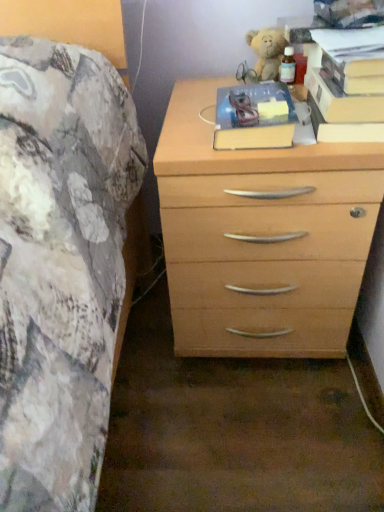
Describe the element at coordinates (356, 71) in the screenshot. I see `hardcover book at upper right, marked as the first paperback book in a right-to-left arrangement` at that location.

This screenshot has width=384, height=512. In order to click on hardcover book at upper right, placed as the 2th paperback book when sorted from left to right in this screenshot , I will do `click(342, 101)`.

At what (x,y) coordinates should I click in order to perform the action: click on hardcover book at upper right, marked as the first paperback book in a right-to-left arrangement. Please return your answer as a coordinate pair (x, y). Looking at the image, I should click on (356, 71).

Does hardcover book at upper right, marked as the first paperback book in a right-to-left arrangement, turn towards hardcover book at center, the 3th paperback book viewed from the right?

No, hardcover book at upper right, marked as the first paperback book in a right-to-left arrangement, does not turn towards hardcover book at center, the 3th paperback book viewed from the right.

Is point (374, 83) closer or farther from the camera than point (241, 115)?

Point (374, 83) is positioned closer to the camera compared to point (241, 115).

Between hardcover book at upper right, placed as the third paperback book when sorted from left to right, and hardcover book at center, which appears as the 1th paperback book when viewed from the left, which one has larger size?

Bigger between the two is hardcover book at center, which appears as the 1th paperback book when viewed from the left.

From a real-world perspective, is light wood chest of drawers at right beneath hardcover book at upper right, placed as the third paperback book when sorted from left to right?

Yes, from a real-world perspective, light wood chest of drawers at right is below hardcover book at upper right, placed as the third paperback book when sorted from left to right.

Who is shorter, light wood chest of drawers at right or hardcover book at upper right, marked as the first paperback book in a right-to-left arrangement?

Standing shorter between the two is hardcover book at upper right, marked as the first paperback book in a right-to-left arrangement.

Based on their positions, is light wood chest of drawers at right located to the left or right of hardcover book at upper right, marked as the first paperback book in a right-to-left arrangement?

Answer: light wood chest of drawers at right is to the left of hardcover book at upper right, marked as the first paperback book in a right-to-left arrangement.

Considering the positions of objects light wood chest of drawers at right and hardcover book at upper right, marked as the first paperback book in a right-to-left arrangement, in the image provided, who is in front, light wood chest of drawers at right or hardcover book at upper right, marked as the first paperback book in a right-to-left arrangement,?

hardcover book at upper right, marked as the first paperback book in a right-to-left arrangement, is more forward.

From a real-world perspective, which is physically below, fluffy beige teddy bear at upper right or hardcover book at upper right, marked as the first paperback book in a right-to-left arrangement?

From a 3D spatial view, fluffy beige teddy bear at upper right is below.

Does fluffy beige teddy bear at upper right have a lesser height compared to hardcover book at upper right, marked as the first paperback book in a right-to-left arrangement?

In fact, fluffy beige teddy bear at upper right may be taller than hardcover book at upper right, marked as the first paperback book in a right-to-left arrangement.

Which of these two, fluffy beige teddy bear at upper right or hardcover book at upper right, marked as the first paperback book in a right-to-left arrangement, is wider?

With larger width is hardcover book at upper right, marked as the first paperback book in a right-to-left arrangement.

Is light wood chest of drawers at right in front of or behind hardcover book at center, which appears as the 1th paperback book when viewed from the left, in the image?

light wood chest of drawers at right is positioned closer to the viewer than hardcover book at center, which appears as the 1th paperback book when viewed from the left.

Would you say light wood chest of drawers at right is a long distance from hardcover book at center, which appears as the 1th paperback book when viewed from the left?

No.

Which is nearer, (x=333, y=275) or (x=214, y=134)?

Positioned in front is point (x=214, y=134).

Is hardcover book at center, which appears as the 1th paperback book when viewed from the left, at the back of light wood chest of drawers at right?

light wood chest of drawers at right is not turned away from hardcover book at center, which appears as the 1th paperback book when viewed from the left.

Does hardcover book at upper right, marked as the first paperback book in a right-to-left arrangement, have a lesser height compared to hardcover book at upper right, which ranks as the 2th paperback book in right-to-left order?

Indeed, hardcover book at upper right, marked as the first paperback book in a right-to-left arrangement, has a lesser height compared to hardcover book at upper right, which ranks as the 2th paperback book in right-to-left order.

From a real-world perspective, which is physically above, hardcover book at upper right, placed as the third paperback book when sorted from left to right, or hardcover book at upper right, placed as the 2th paperback book when sorted from left to right?

hardcover book at upper right, placed as the third paperback book when sorted from left to right.

Looking at this image, are hardcover book at upper right, placed as the third paperback book when sorted from left to right, and hardcover book at upper right, placed as the 2th paperback book when sorted from left to right, located far from each other?

Actually, hardcover book at upper right, placed as the third paperback book when sorted from left to right, and hardcover book at upper right, placed as the 2th paperback book when sorted from left to right, are a little close together.

Considering the relative positions of hardcover book at upper right, placed as the third paperback book when sorted from left to right, and hardcover book at upper right, placed as the 2th paperback book when sorted from left to right, in the image provided, is hardcover book at upper right, placed as the third paperback book when sorted from left to right, to the left or to the right of hardcover book at upper right, placed as the 2th paperback book when sorted from left to right,?

In the image, hardcover book at upper right, placed as the third paperback book when sorted from left to right, appears on the right side of hardcover book at upper right, placed as the 2th paperback book when sorted from left to right.

From the image's perspective, is hardcover book at center, the 3th paperback book viewed from the right, on top of hardcover book at upper right, marked as the first paperback book in a right-to-left arrangement?

Incorrect, from the image's perspective, hardcover book at center, the 3th paperback book viewed from the right, is lower than hardcover book at upper right, marked as the first paperback book in a right-to-left arrangement.

Considering the relative positions of hardcover book at center, which appears as the 1th paperback book when viewed from the left, and hardcover book at upper right, placed as the third paperback book when sorted from left to right, in the image provided, is hardcover book at center, which appears as the 1th paperback book when viewed from the left, to the left or to the right of hardcover book at upper right, placed as the third paperback book when sorted from left to right,?

In the image, hardcover book at center, which appears as the 1th paperback book when viewed from the left, appears on the left side of hardcover book at upper right, placed as the third paperback book when sorted from left to right.

Who is more distant, hardcover book at center, which appears as the 1th paperback book when viewed from the left, or hardcover book at upper right, placed as the third paperback book when sorted from left to right?

Positioned behind is hardcover book at center, which appears as the 1th paperback book when viewed from the left.

Is point (234, 101) farther from camera compared to point (337, 82)?

Yes.

Considering the sizes of objects light wood chest of drawers at right and fluffy beige teddy bear at upper right in the image provided, who is thinner, light wood chest of drawers at right or fluffy beige teddy bear at upper right?

fluffy beige teddy bear at upper right.

Locate an element on the screen. The image size is (384, 512). the chest of drawers beneath the fluffy beige teddy bear at upper right (from a real-world perspective) is located at coordinates (261, 236).

Is point (294, 232) positioned in front of point (276, 61)?

Yes, point (294, 232) is in front of point (276, 61).

From a real-world perspective, who is located higher, light wood chest of drawers at right or fluffy beige teddy bear at upper right?

fluffy beige teddy bear at upper right.

You are a GUI agent. You are given a task and a screenshot of the screen. Output one action in this format:
    pyautogui.click(x=<x>, y=<y>)
    Task: Click on the 2nd paperback book to the left when counting from the hardcover book at upper right, placed as the third paperback book when sorted from left to right
    This screenshot has width=384, height=512.
    Given the screenshot: What is the action you would take?
    pyautogui.click(x=254, y=117)

At what (x,y) coordinates should I click in order to perform the action: click on paperback book that is the 3rd object located above the light wood chest of drawers at right (from the image's perspective). Please return your answer as a coordinate pair (x, y). The height and width of the screenshot is (512, 384). Looking at the image, I should click on (356, 71).

Estimate the real-world distances between objects in this image. Which object is closer to fluffy beige teddy bear at upper right, light wood chest of drawers at right or hardcover book at center, which appears as the 1th paperback book when viewed from the left?

hardcover book at center, which appears as the 1th paperback book when viewed from the left, lies closer to fluffy beige teddy bear at upper right than the other object.

When comparing their distances from hardcover book at center, the 3th paperback book viewed from the right, does fluffy beige teddy bear at upper right or hardcover book at upper right, marked as the first paperback book in a right-to-left arrangement, seem further?

fluffy beige teddy bear at upper right lies further to hardcover book at center, the 3th paperback book viewed from the right, than the other object.

When comparing their distances from hardcover book at upper right, marked as the first paperback book in a right-to-left arrangement, does hardcover book at upper right, which ranks as the 2th paperback book in right-to-left order, or fluffy beige teddy bear at upper right seem further?

The object further to hardcover book at upper right, marked as the first paperback book in a right-to-left arrangement, is fluffy beige teddy bear at upper right.

When comparing their distances from hardcover book at upper right, marked as the first paperback book in a right-to-left arrangement, does hardcover book at upper right, placed as the 2th paperback book when sorted from left to right, or hardcover book at center, which appears as the 1th paperback book when viewed from the left, seem further?

hardcover book at center, which appears as the 1th paperback book when viewed from the left, lies further to hardcover book at upper right, marked as the first paperback book in a right-to-left arrangement, than the other object.

Estimate the real-world distances between objects in this image. Which object is further from hardcover book at upper right, which ranks as the 2th paperback book in right-to-left order, fluffy beige teddy bear at upper right or hardcover book at upper right, marked as the first paperback book in a right-to-left arrangement?

fluffy beige teddy bear at upper right.

In the scene shown: Estimate the real-world distances between objects in this image. Which object is closer to hardcover book at upper right, placed as the third paperback book when sorted from left to right, light wood chest of drawers at right or fluffy beige teddy bear at upper right?

Among the two, light wood chest of drawers at right is located nearer to hardcover book at upper right, placed as the third paperback book when sorted from left to right.

Based on their spatial positions, is hardcover book at upper right, marked as the first paperback book in a right-to-left arrangement, or hardcover book at upper right, which ranks as the 2th paperback book in right-to-left order, further from fluffy beige teddy bear at upper right?

The object further to fluffy beige teddy bear at upper right is hardcover book at upper right, marked as the first paperback book in a right-to-left arrangement.

Which object lies nearer to the anchor point fluffy beige teddy bear at upper right, hardcover book at center, the 3th paperback book viewed from the right, or hardcover book at upper right, marked as the first paperback book in a right-to-left arrangement?

hardcover book at center, the 3th paperback book viewed from the right.

Find the location of a particular element. paperback book that lies between hardcover book at upper right, placed as the 2th paperback book when sorted from left to right, and light wood chest of drawers at right from top to bottom is located at coordinates (254, 117).

Where is `paperback book positioned between hardcover book at upper right, placed as the 2th paperback book when sorted from left to right, and fluffy beige teddy bear at upper right from near to far`? paperback book positioned between hardcover book at upper right, placed as the 2th paperback book when sorted from left to right, and fluffy beige teddy bear at upper right from near to far is located at coordinates (254, 117).

The image size is (384, 512). Find the location of `paperback book situated between hardcover book at center, the 3th paperback book viewed from the right, and hardcover book at upper right, marked as the first paperback book in a right-to-left arrangement, from left to right`. paperback book situated between hardcover book at center, the 3th paperback book viewed from the right, and hardcover book at upper right, marked as the first paperback book in a right-to-left arrangement, from left to right is located at coordinates (342, 101).